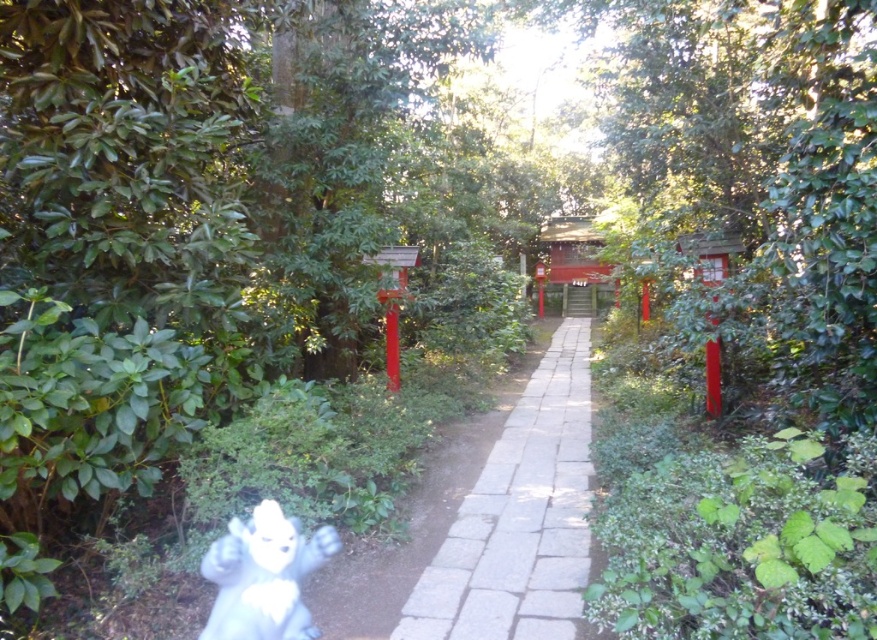
You are a visitor at the shrine and want to place the white plush toy at lower left on the white stone path at center. Will the toy be visible once placed there?

The white stone path at center is much taller than the white plush toy at lower left. If you place the white plush toy at lower left on the white stone path at center, the toy might be hidden or less visible because the path is significantly taller than the toy.

You are a visitor at the shrine and want to place your white plush toy at lower left on the ground near the white stone path at center. Can you place it directly under the path?

The white stone path at center is above the white plush toy at lower left, so yes, you can place the white plush toy at lower left directly under the path.